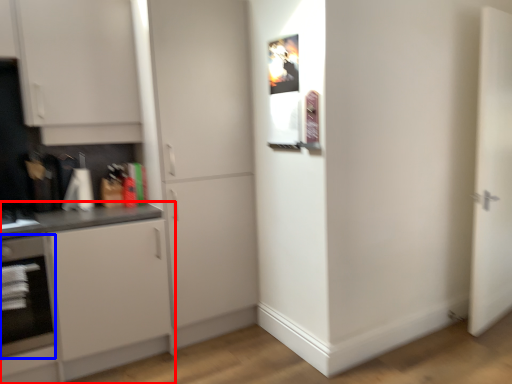
Question: Which of the following is the closest to the observer, cabinetry (highlighted by a red box) or oven (highlighted by a blue box)?

Choices:
 (A) cabinetry
 (B) oven

Answer: (A)